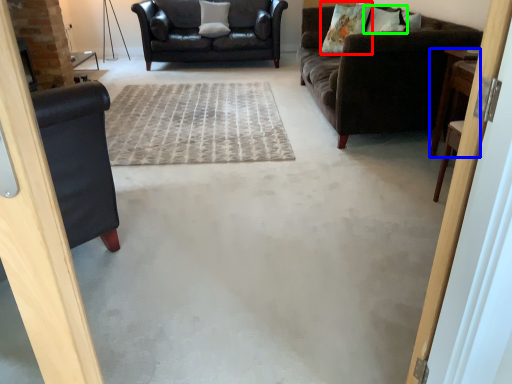
Question: Based on their relative distances, which object is farther from pillow (highlighted by a red box)? Choose from table (highlighted by a blue box) and pillow (highlighted by a green box).

Choices:
 (A) table
 (B) pillow

Answer: (A)